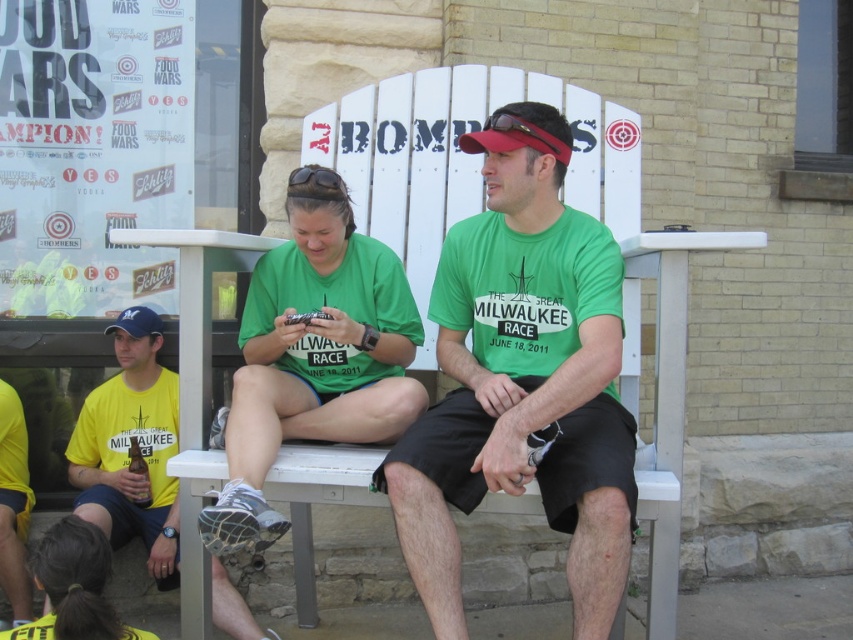
You are organizing a charity clothing drive and need to categorize shirts by size. You have a green cotton shirt at center and a yellow matte shirt at left. Which shirt should you place in the large size bin?

The green cotton shirt at center is larger in size than the yellow matte shirt at left, so it should be placed in the large size bin.

You are standing in front of the white Adirondack bench where two people are sitting. There are two points marked on the bench. One is at coordinate point (413,570) and the other is at point (221,611). Which of these two points is closer to you?

Point (413,570) is closer to the viewer than point (221,611).

You are organizing a clothing donation drive and need to know which shirt takes up more space when folded. Based on the image, which of the two shirts, the green cotton shirt at center or the yellow matte shirt at left, is narrower?

The green cotton shirt at center is narrower than the yellow matte shirt at left, so it takes up less space when folded.